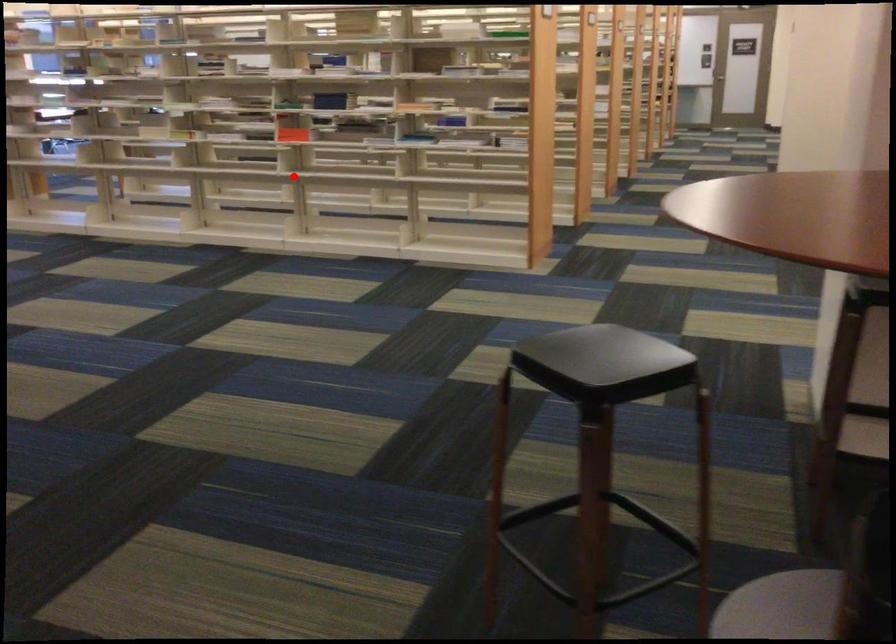
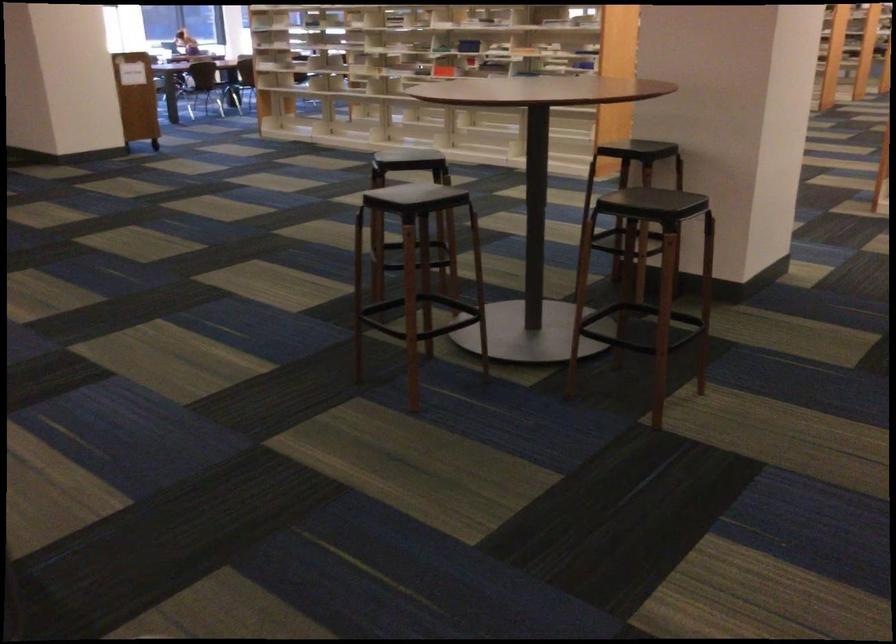
Question: I am providing you with two images of the same scene from different viewpoints. Image1 has a red point marked. In image2, the corresponding 3D location appears at what relative position? Reply with the corresponding letter.

Choices:
 (A) Closer
 (B) Farther

Answer: (B)